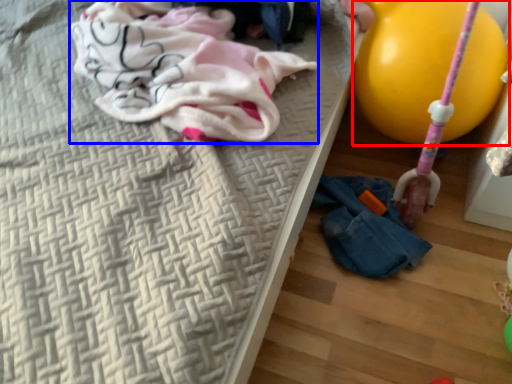
Question: Which of the following is the closest to the observer, balloon (highlighted by a red box) or clothing (highlighted by a blue box)?

Choices:
 (A) balloon
 (B) clothing

Answer: (B)